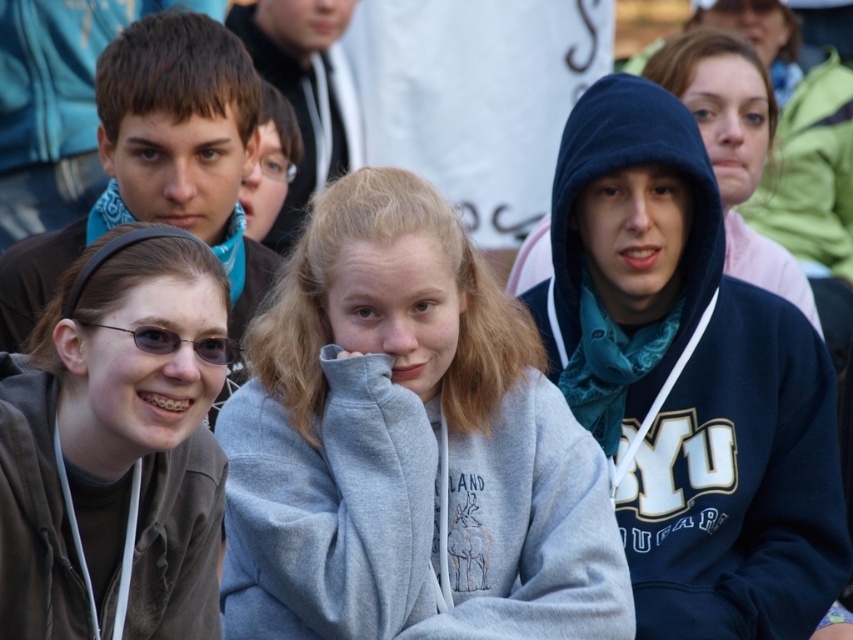
You are standing in the scene and want to reach both points, point [62,576] and point [730,48]. Which point should you reach first to minimize the distance walked?

You should reach point [62,576] first because it is closer to the viewer than point [730,48].

You are a photographer trying to capture a clear shot of the matte blue hoodie at center and the black plastic glasses at lower left. Since you want to focus on both objects equally, which one should you adjust your camera angle to look up at or down at?

The matte blue hoodie at center is located above the black plastic glasses at lower left. To focus on both equally, you should adjust your camera angle to look down at the matte blue hoodie at center and up at the black plastic glasses at lower left.